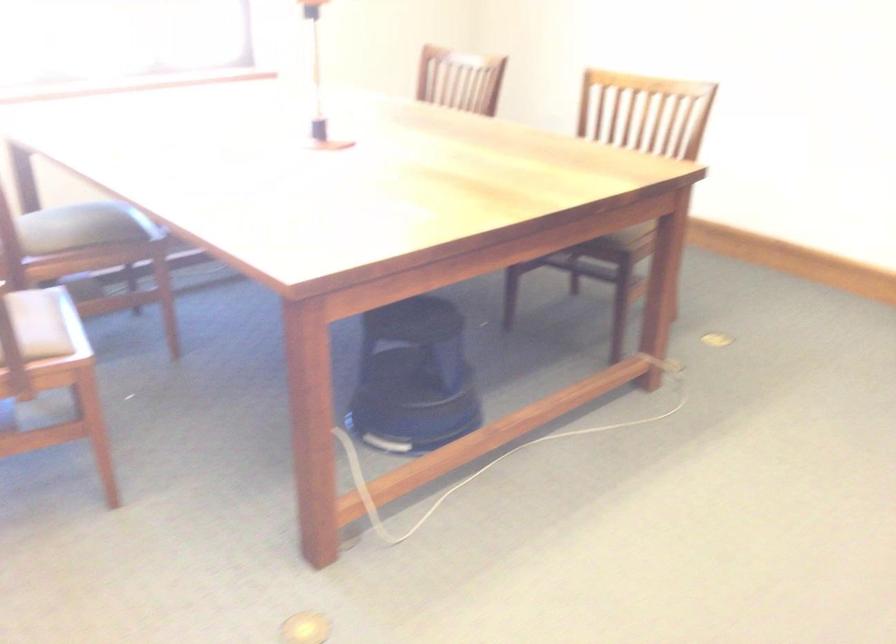
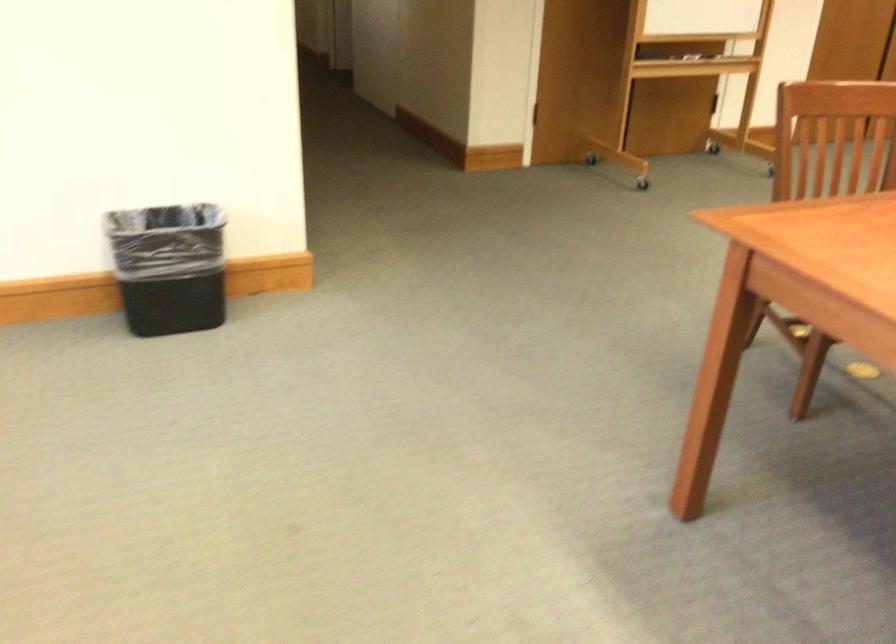
Question: The first image is from the beginning of the video and the second image is from the end. How did the camera likely rotate when shooting the video?

Choices:
 (A) Left
 (B) Right
 (C) Up
 (D) Down

Answer: (B)